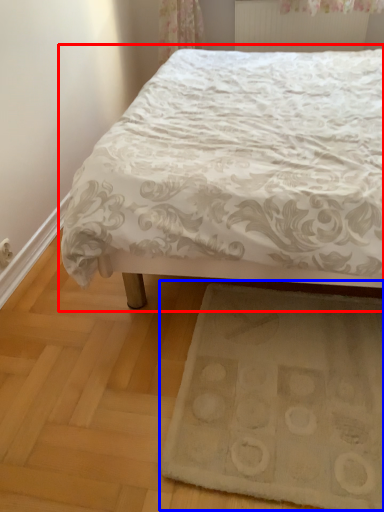
Question: Which of the following is the closest to the observer, bed (highlighted by a red box) or doormat (highlighted by a blue box)?

Choices:
 (A) bed
 (B) doormat

Answer: (A)